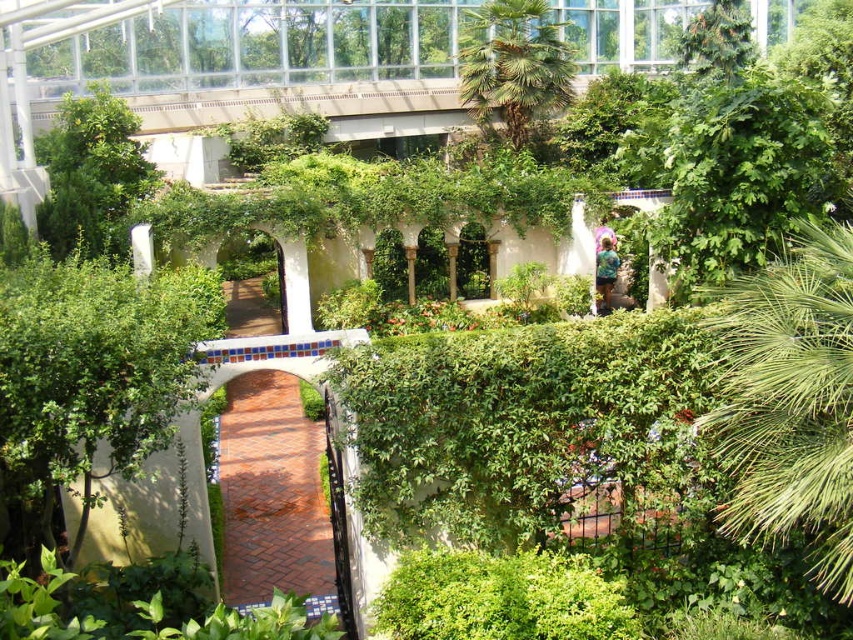
Find the location of a particular element. The height and width of the screenshot is (640, 853). green leafy tree at upper left is located at coordinates (91, 176).

Is point (119, 228) farther from viewer compared to point (537, 64)?

No.

Locate an element on the screen. Image resolution: width=853 pixels, height=640 pixels. green leafy tree at upper left is located at coordinates (91, 176).

Is green leafy palm at right to the left of green leafy palm tree at upper center from the viewer's perspective?

Incorrect, green leafy palm at right is not on the left side of green leafy palm tree at upper center.

Between point (721, 337) and point (534, 112), which one is positioned in front?

Point (721, 337) is in front.

Which is in front, point (782, 276) or point (567, 65)?

Point (782, 276)

Where is `green leafy palm at right`? This screenshot has height=640, width=853. green leafy palm at right is located at coordinates point(790,401).

At what (x,y) coordinates should I click in order to perform the action: click on green leafy bush at lower left. Please return your answer as a coordinate pair (x, y). The width and height of the screenshot is (853, 640). Looking at the image, I should click on (94, 372).

Is green leafy bush at lower left in front of green leafy tree at upper left?

Yes.

Locate an element on the screen. The image size is (853, 640). green leafy bush at lower left is located at coordinates (94, 372).